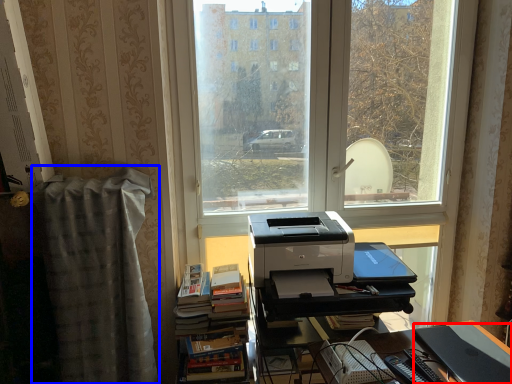
Question: Which point is closer to the camera, register (highlighted by a red box) or curtain (highlighted by a blue box)?

Choices:
 (A) register
 (B) curtain

Answer: (A)